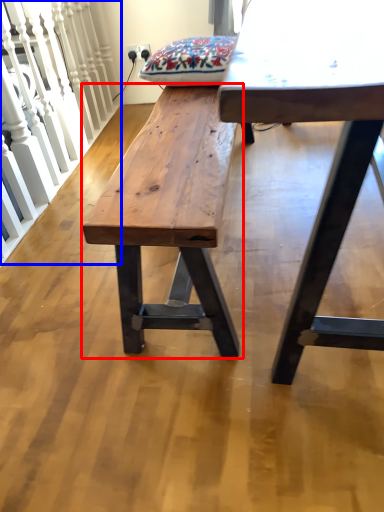
Question: Which object appears farthest to the camera in this image, bench (highlighted by a red box) or rail (highlighted by a blue box)?

Choices:
 (A) bench
 (B) rail

Answer: (B)